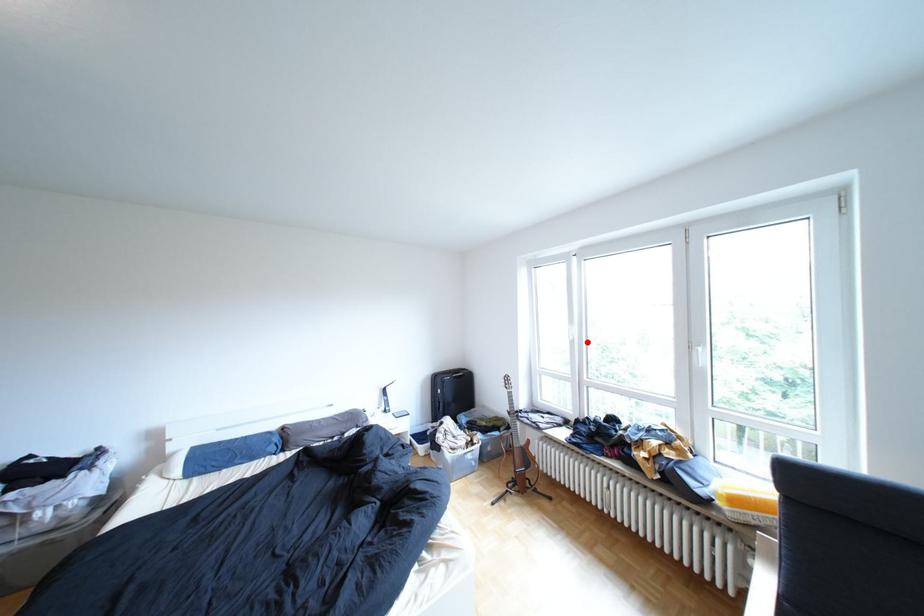
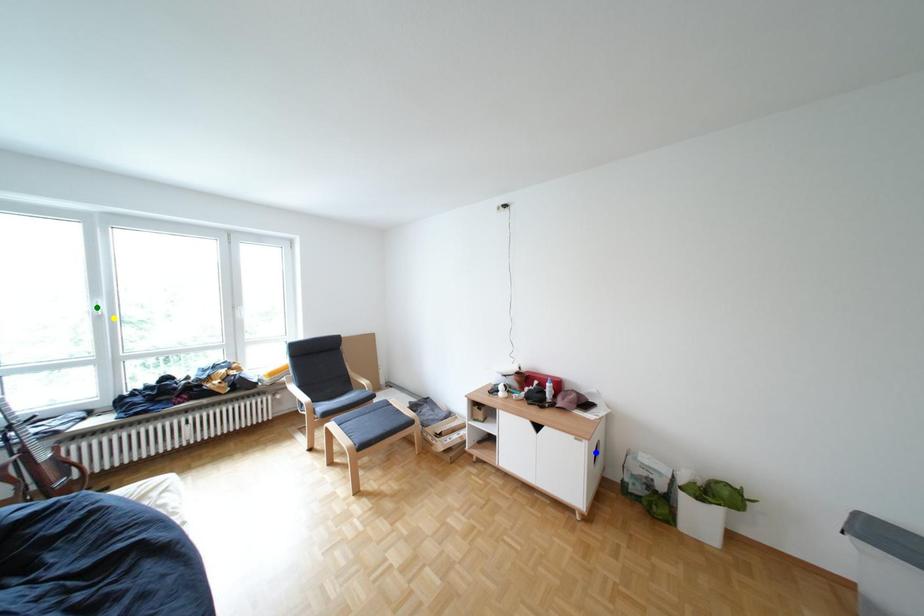
Question: I am providing you with two images of the same scene from different viewpoints. A red point is marked on the first image. You are given multiple points on the second image. Which spot in image 2 lines up with the point in image 1?

Choices:
 (A) yellow point
 (B) blue point
 (C) green point

Answer: (A)